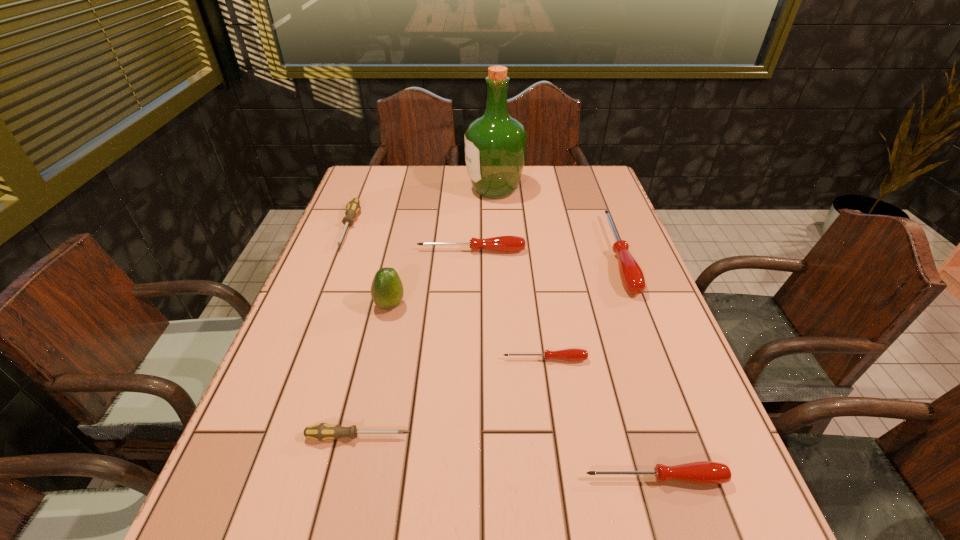
The width and height of the screenshot is (960, 540). In order to click on liquor in this screenshot , I will do coord(495,144).

Identify the location of the farthest object. The image size is (960, 540). (495, 144).

At what (x,y) coordinates should I click in order to perform the action: click on green avocado. Please return your answer as a coordinate pair (x, y). Looking at the image, I should click on (387, 291).

I want to click on avocado, so click(x=387, y=291).

Where is `the tallest screwdriver`? The image size is (960, 540). the tallest screwdriver is located at coordinates (631, 274).

At what (x,y) coordinates should I click in order to perform the action: click on the third tallest object. Please return your answer as a coordinate pair (x, y). This screenshot has width=960, height=540. Looking at the image, I should click on (631, 274).

Find the location of a particular element. The image size is (960, 540). the third smallest red screwdriver is located at coordinates (502, 243).

Locate an element on the screen. the left gray screwdriver is located at coordinates (353, 207).

Find the location of `the leftmost object`. the leftmost object is located at coordinates (353, 207).

This screenshot has width=960, height=540. Identify the location of the nearest screwdriver. (702, 472).